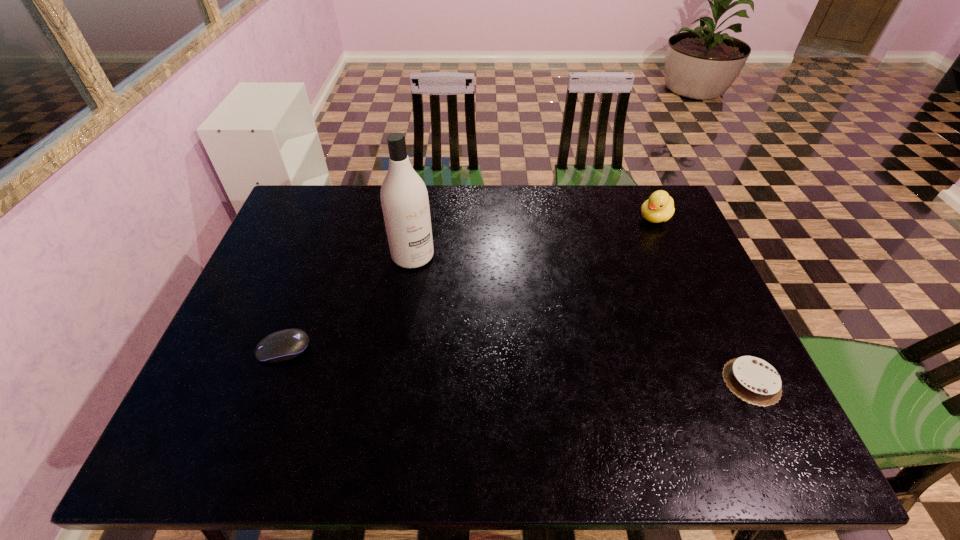
The width and height of the screenshot is (960, 540). What are the coordinates of `vacant point that satisfies the following two spatial constraints: 1. on the front side of the chocolate cake; 2. on the left side of the leftmost object` in the screenshot? It's located at (272, 381).